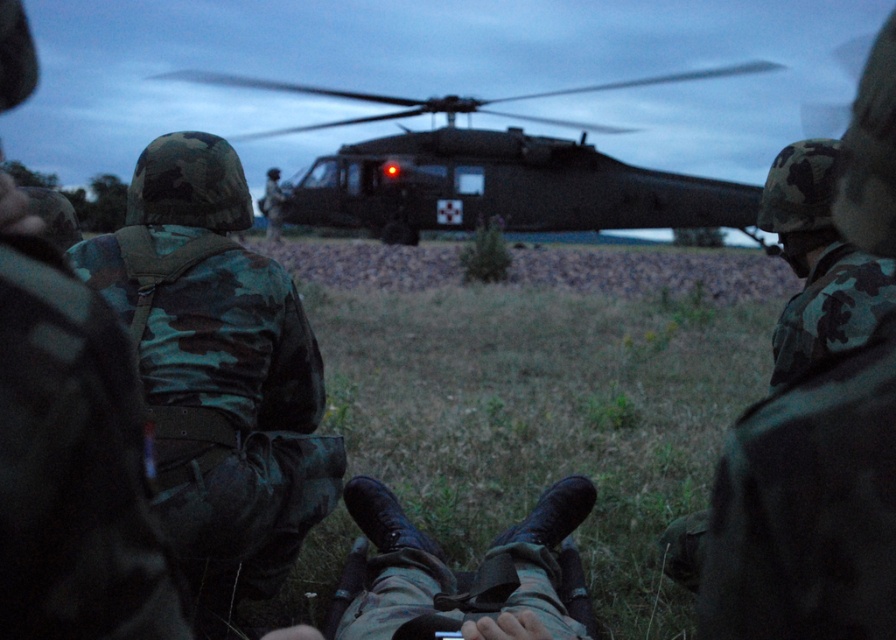
Based on the photo, is camo fabric uniform at center smaller than dark matte helicopter at center?

Yes.

Is camo fabric uniform at center positioned in front of dark matte helicopter at center?

That is True.

Image resolution: width=896 pixels, height=640 pixels. Identify the location of camo fabric uniform at center. (217, 371).

Is camo fabric uniform at center closer to the viewer compared to matte black gun at lower center?

That is True.

Who is shorter, camo fabric uniform at center or matte black gun at lower center?

Standing shorter between the two is matte black gun at lower center.

Which is in front, point (250, 372) or point (334, 616)?

Point (334, 616) is in front.

The height and width of the screenshot is (640, 896). In order to click on camo fabric uniform at center in this screenshot , I will do `click(217, 371)`.

Is dark matte helicopter at center shorter than matte black gun at lower center?

No.

Identify the location of dark matte helicopter at center. Image resolution: width=896 pixels, height=640 pixels. (493, 172).

Identify the location of dark matte helicopter at center. This screenshot has width=896, height=640. (493, 172).